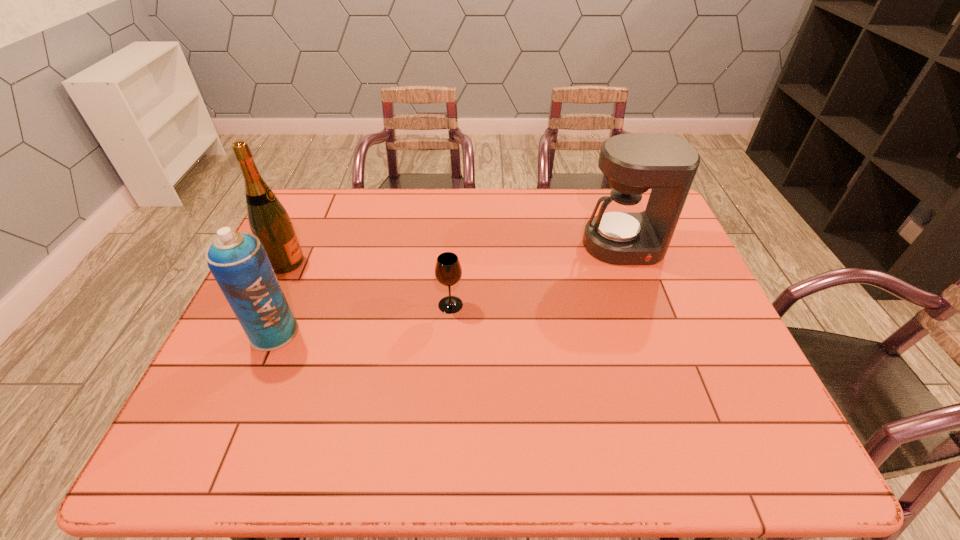
Locate an element on the screen. wine bottle situated at the left edge is located at coordinates (268, 219).

Identify the location of aerosol can that is positioned at the left edge. This screenshot has width=960, height=540. (238, 261).

The image size is (960, 540). In order to click on object that is at the right edge in this screenshot , I will do `click(622, 233)`.

Identify the location of object located at the far right corner. (622, 233).

In the image, there is a desktop. In order to click on blank space at the far edge in this screenshot , I will do (x=477, y=197).

What are the coordinates of `vacant space at the near edge of the desktop` in the screenshot? It's located at (527, 456).

In the image, there is a desktop. What are the coordinates of `vacant space at the left edge` in the screenshot? It's located at [243, 416].

I want to click on free space at the right edge of the desktop, so click(698, 296).

This screenshot has height=540, width=960. What are the coordinates of `vacant space at the far left corner of the desktop` in the screenshot? It's located at (325, 206).

Where is `free space at the near right corner of the desktop`? free space at the near right corner of the desktop is located at coordinates (782, 468).